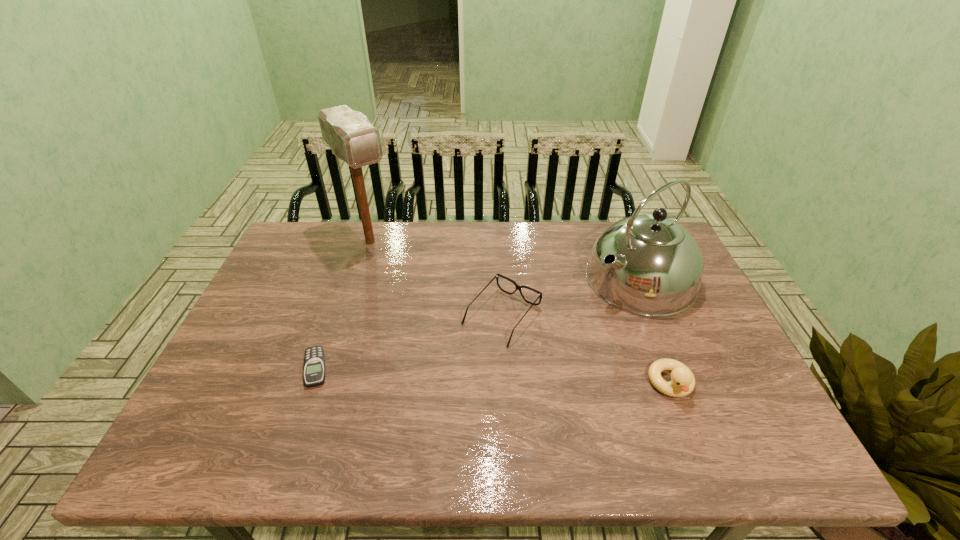
Locate an element on the screen. Image resolution: width=960 pixels, height=540 pixels. free space located from the spout of the fourth shortest object is located at coordinates (546, 335).

Where is `free space located 0.110m from the spout of the fourth shortest object`? The width and height of the screenshot is (960, 540). free space located 0.110m from the spout of the fourth shortest object is located at coordinates (576, 317).

Where is `vacant space located 0.380m from the spout of the fourth shortest object`? vacant space located 0.380m from the spout of the fourth shortest object is located at coordinates (499, 363).

Where is `free space located 0.170m with the lenses facing outward on the second shortest object`? The height and width of the screenshot is (540, 960). free space located 0.170m with the lenses facing outward on the second shortest object is located at coordinates (439, 388).

I want to click on vacant space located 0.100m with the lenses facing outward on the second shortest object, so click(456, 368).

Locate an element on the screen. This screenshot has width=960, height=540. free space located with the lenses facing outward on the second shortest object is located at coordinates (456, 368).

Find the location of a particular element. This screenshot has height=540, width=960. mallet present at the far edge is located at coordinates (351, 137).

At what (x,y) coordinates should I click in order to perform the action: click on kettle located at the far edge. Please return your answer as a coordinate pair (x, y). The height and width of the screenshot is (540, 960). Looking at the image, I should click on (658, 270).

Identify the location of beeper that is positioned at the near edge. (314, 363).

This screenshot has height=540, width=960. What are the coordinates of `duckling that is at the near edge` in the screenshot? It's located at (682, 383).